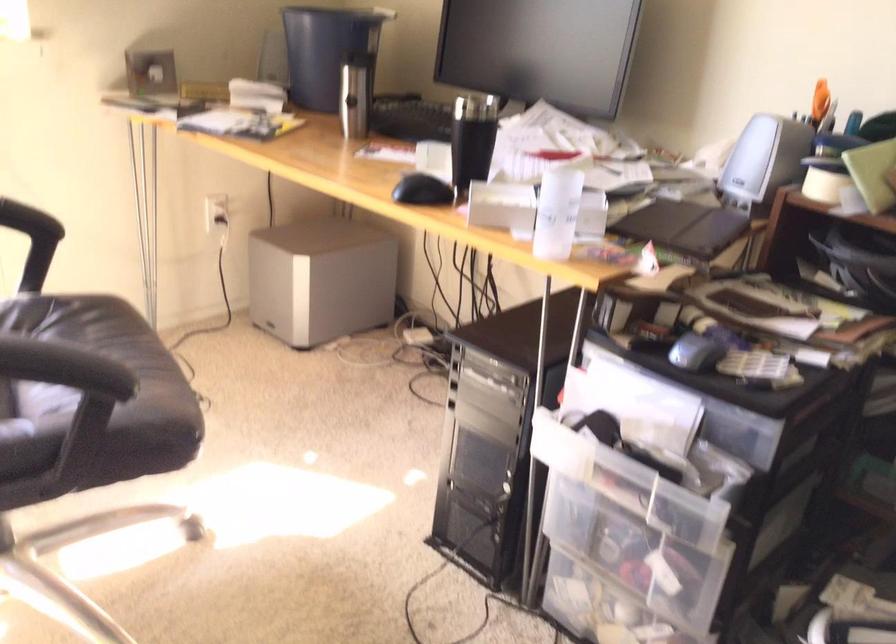
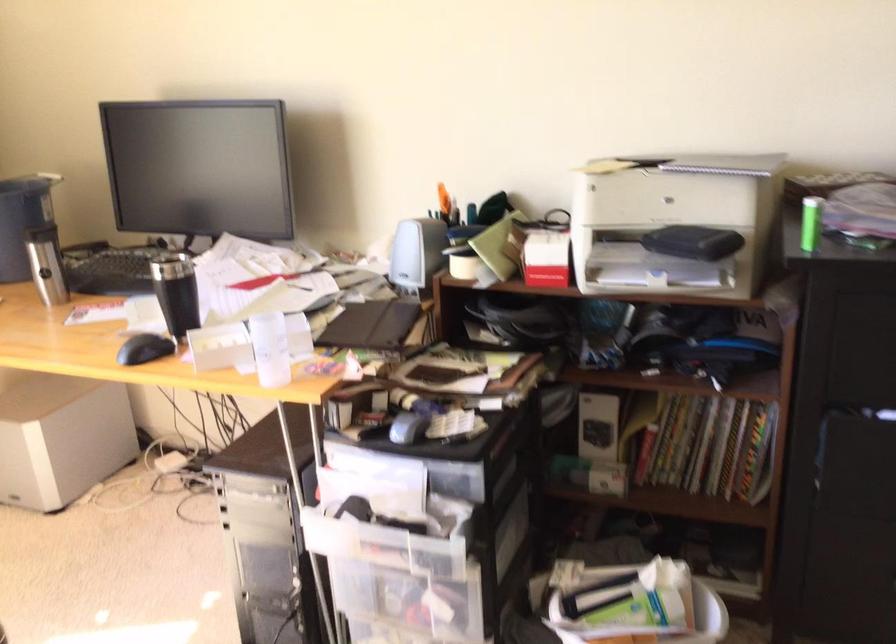
In the second image, find the point that corresponds to (418,191) in the first image.

(143, 348)